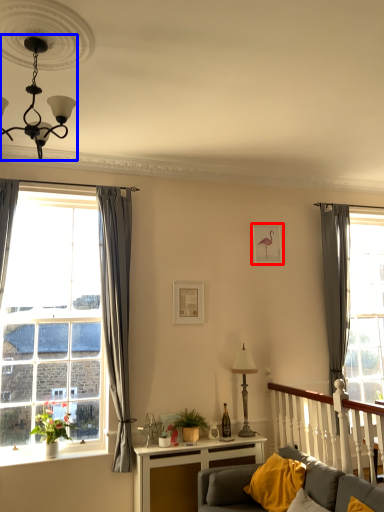
Question: Which point is closer to the camera, picture frame (highlighted by a red box) or light fixture (highlighted by a blue box)?

Choices:
 (A) picture frame
 (B) light fixture

Answer: (B)